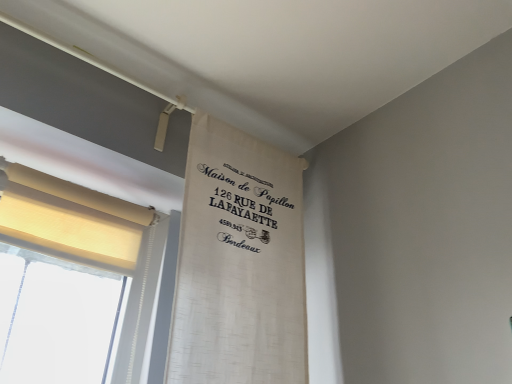
Question: Choose the correct answer: Is beige fabric curtain at left, which ranks as the first curtain in left-to-right order, inside white woven curtain at upper center, the 2th curtain in the left-to-right sequence, or outside it?

Choices:
 (A) outside
 (B) inside

Answer: (A)

Question: Considering the positions of point (123, 223) and point (284, 312), is point (123, 223) closer or farther from the camera than point (284, 312)?

Choices:
 (A) closer
 (B) farther

Answer: (B)

Question: Considering the positions of beige fabric curtain at left, arranged as the 2th curtain when viewed from the right, and white woven curtain at upper center, positioned as the first curtain in right-to-left order, in the image, is beige fabric curtain at left, arranged as the 2th curtain when viewed from the right, wider or thinner than white woven curtain at upper center, positioned as the first curtain in right-to-left order,?

Choices:
 (A) wide
 (B) thin

Answer: (A)

Question: Is white woven curtain at upper center, the 2th curtain in the left-to-right sequence, bigger or smaller than beige fabric curtain at left, arranged as the 2th curtain when viewed from the right?

Choices:
 (A) small
 (B) big

Answer: (B)

Question: Is point (188, 223) closer or farther from the camera than point (112, 230)?

Choices:
 (A) farther
 (B) closer

Answer: (B)

Question: Considering the relative positions of white woven curtain at upper center, the 2th curtain in the left-to-right sequence, and beige fabric curtain at left, arranged as the 2th curtain when viewed from the right, in the image provided, is white woven curtain at upper center, the 2th curtain in the left-to-right sequence, to the left or to the right of beige fabric curtain at left, arranged as the 2th curtain when viewed from the right,?

Choices:
 (A) right
 (B) left

Answer: (A)

Question: Is white woven curtain at upper center, positioned as the first curtain in right-to-left order, in front of or behind beige fabric curtain at left, arranged as the 2th curtain when viewed from the right, in the image?

Choices:
 (A) front
 (B) behind

Answer: (A)